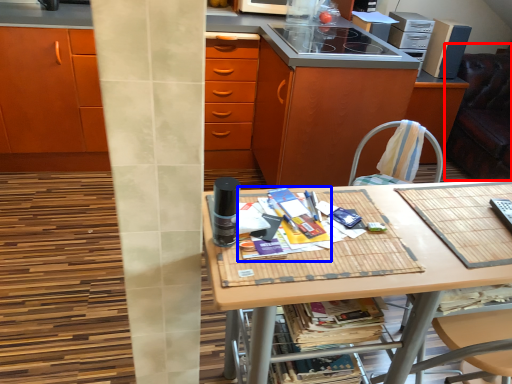
Question: Which object appears farthest to the camera in this image, swivel chair (highlighted by a red box) or magazine (highlighted by a blue box)?

Choices:
 (A) swivel chair
 (B) magazine

Answer: (A)